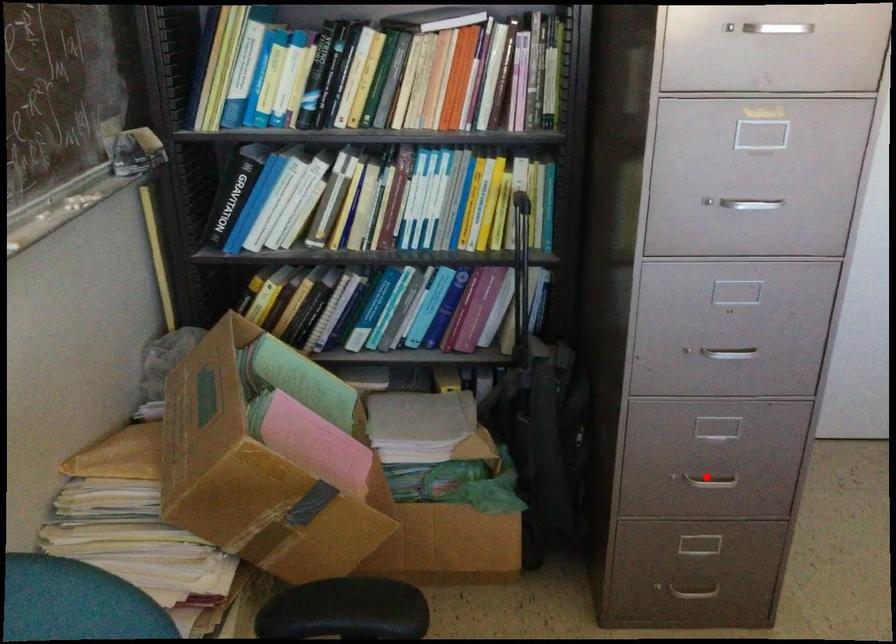
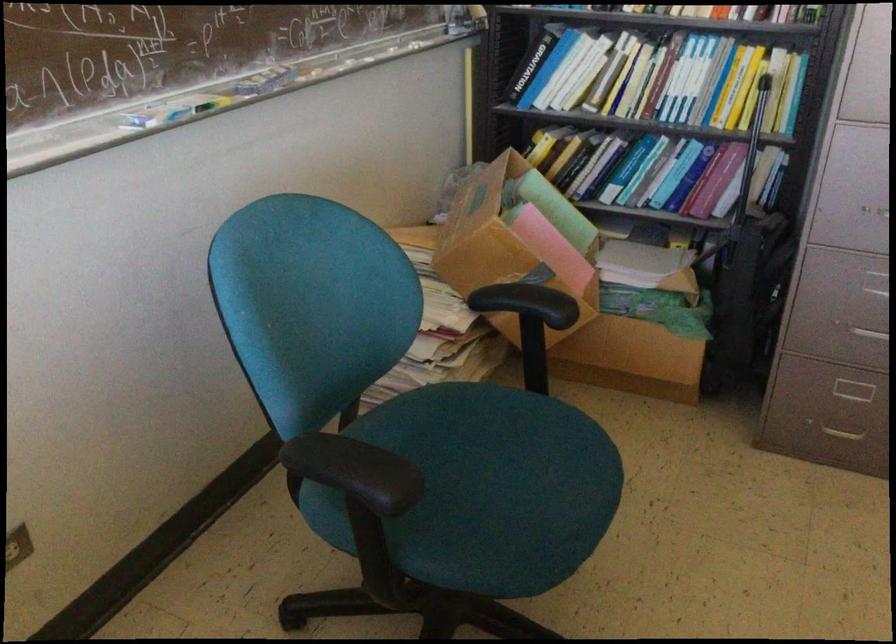
Find the pixel in the second image that matches the highlighted location in the first image.

(869, 330)